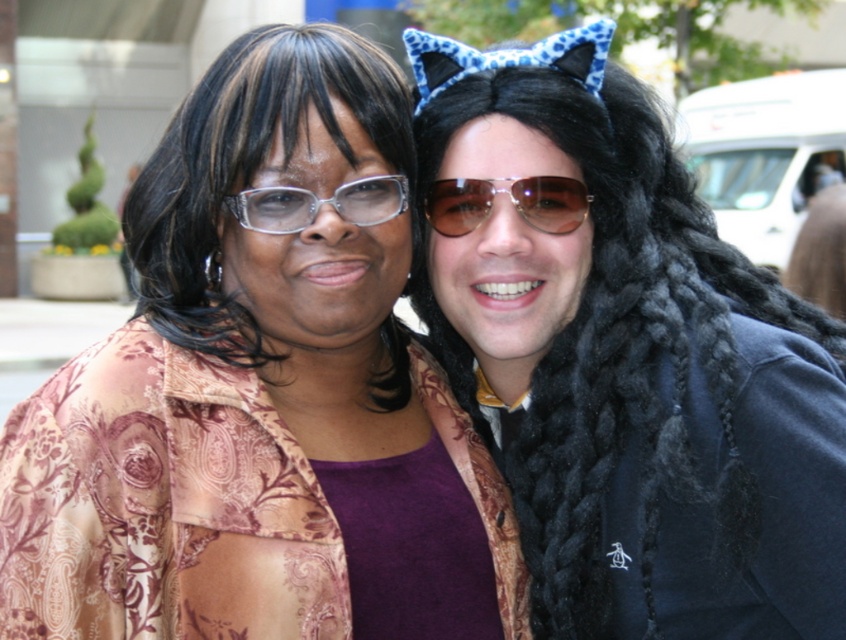
You are a photographer at the event and want to capture a clear photo of the brown reflective aviator sunglasses at center without the black braided wig at right blocking it. What should you do?

The black braided wig at right is in front of the brown reflective aviator sunglasses at center, so you should move the black braided wig at right out of the way or adjust your angle to avoid the obstruction.

You are a photographer trying to capture a closeup shot of the transparent plastic glasses at center and the brown reflective aviator sunglasses at center. Since both are at the center, which one is positioned to the right side of the other?

The brown reflective aviator sunglasses at center is to the right of transparent plastic glasses at center, so the aviator sunglasses are positioned to the right of the transparent glasses.

You are a photographer at the event and need to capture a closeup shot of the black braided wig at right and the brown reflective aviator sunglasses at center. Which object should you focus on first if you want to ensure both are in frame without moving the camera?

The black braided wig at right is larger in size than the brown reflective aviator sunglasses at center, so you should focus on the black braided wig at right first to ensure both fit within the frame.